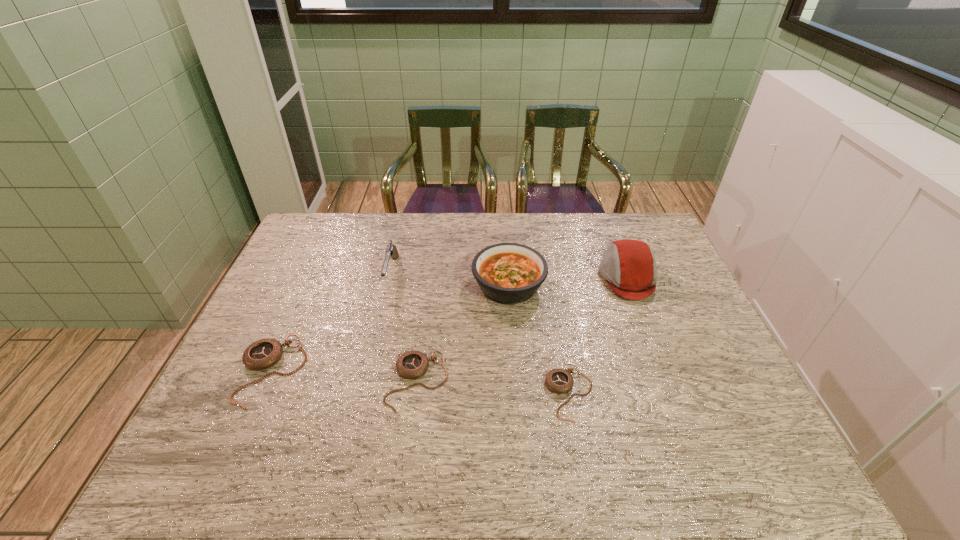
Where is `vacant space at the far edge`? vacant space at the far edge is located at coordinates (402, 251).

Image resolution: width=960 pixels, height=540 pixels. In the image, there is a desktop. Identify the location of free space at the near edge. (386, 428).

In the image, there is a desktop. At what (x,y) coordinates should I click in order to perform the action: click on free region at the left edge. Please return your answer as a coordinate pair (x, y). Looking at the image, I should click on pos(275,319).

Where is `vacant area at the right edge of the desktop`? The image size is (960, 540). vacant area at the right edge of the desktop is located at coordinates tap(663, 254).

Locate an element on the screen. The height and width of the screenshot is (540, 960). vacant space at the far left corner of the desktop is located at coordinates (324, 235).

Locate an element on the screen. vacant area at the far right corner is located at coordinates (637, 238).

Image resolution: width=960 pixels, height=540 pixels. I want to click on vacant area between the stew and the rightmost pocket watch, so click(x=540, y=339).

The width and height of the screenshot is (960, 540). I want to click on free space between the gun and the second pocket watch from right to left, so click(404, 327).

This screenshot has height=540, width=960. I want to click on free space between the cap and the stew, so click(568, 281).

Find the location of a particular element. free space between the fifth tallest object and the rightmost pocket watch is located at coordinates (493, 387).